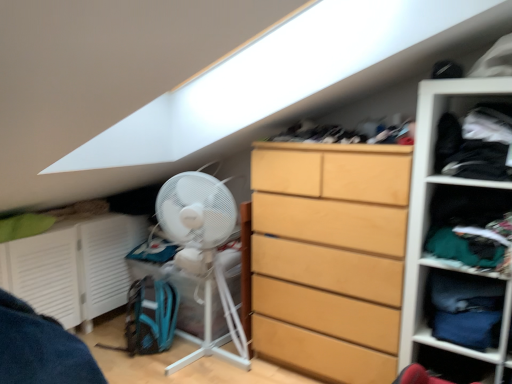
Question: Is the depth of white matte fan at lower left, the 2th cabinet viewed from the front, less than that of white plastic fan at left?

Choices:
 (A) yes
 (B) no

Answer: (B)

Question: Is white matte fan at lower left, the 2th cabinet viewed from the front, smaller than white plastic fan at left?

Choices:
 (A) yes
 (B) no

Answer: (B)

Question: Considering the relative sizes of white matte fan at lower left, the first cabinet when ordered from back to front, and white plastic fan at left in the image provided, is white matte fan at lower left, the first cabinet when ordered from back to front, thinner than white plastic fan at left?

Choices:
 (A) yes
 (B) no

Answer: (A)

Question: Considering the relative positions of white matte fan at lower left, the 2th cabinet positioned from the right, and white plastic fan at left in the image provided, is white matte fan at lower left, the 2th cabinet positioned from the right, to the left of white plastic fan at left from the viewer's perspective?

Choices:
 (A) yes
 (B) no

Answer: (A)

Question: Does white matte fan at lower left, the 2th cabinet viewed from the front, contain white plastic fan at left?

Choices:
 (A) no
 (B) yes

Answer: (A)

Question: Is white matte fan at lower left, the 2th cabinet positioned from the right, directly adjacent to white plastic fan at left?

Choices:
 (A) no
 (B) yes

Answer: (A)

Question: Can you see dark blue fabric at right, the first clothing from the bottom, touching dark blue fabric at upper right, which ranks as the second clothing in bottom-to-top order?

Choices:
 (A) yes
 (B) no

Answer: (B)

Question: Can you confirm if dark blue fabric at right, the first clothing from the bottom, is smaller than dark blue fabric at upper right, which ranks as the second clothing in bottom-to-top order?

Choices:
 (A) yes
 (B) no

Answer: (A)

Question: Is dark blue fabric at right, which ranks as the 2th clothing in top-to-bottom order, positioned with its back to dark blue fabric at upper right, which ranks as the second clothing in bottom-to-top order?

Choices:
 (A) yes
 (B) no

Answer: (B)

Question: Is the depth of dark blue fabric at right, which ranks as the 2th clothing in top-to-bottom order, less than that of dark blue fabric at upper right, which ranks as the second clothing in bottom-to-top order?

Choices:
 (A) no
 (B) yes

Answer: (A)

Question: Is dark blue fabric at right, the first clothing from the bottom, not near dark blue fabric at upper right, placed as the 1th clothing when sorted from top to bottom?

Choices:
 (A) no
 (B) yes

Answer: (A)

Question: Can you confirm if dark blue fabric at right, which ranks as the 2th clothing in top-to-bottom order, is thinner than dark blue fabric at upper right, placed as the 1th clothing when sorted from top to bottom?

Choices:
 (A) yes
 (B) no

Answer: (A)

Question: Is dark blue fabric at upper right, which ranks as the second clothing in bottom-to-top order, surrounding white matte fan at lower left, the first cabinet when ordered from back to front?

Choices:
 (A) yes
 (B) no

Answer: (B)